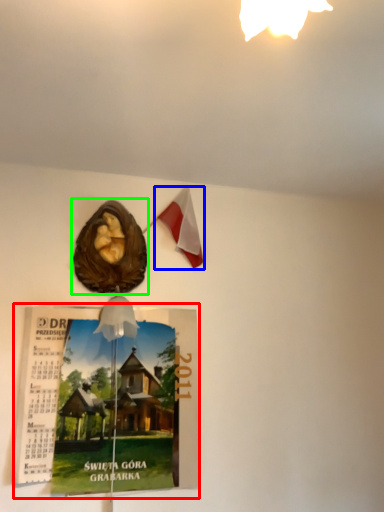
Question: Which object is the closest to the magazine (highlighted by a red box)? Choose among these: flag (highlighted by a blue box) or flyer (highlighted by a green box).

Choices:
 (A) flag
 (B) flyer

Answer: (B)